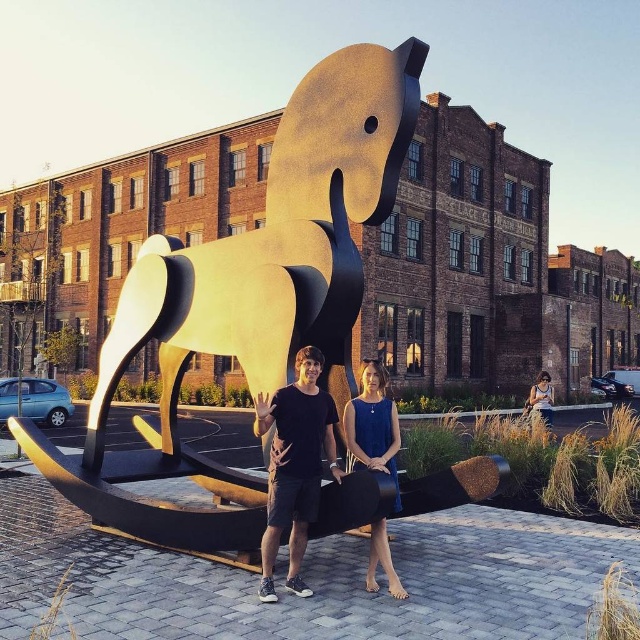
You are a photographer trying to capture a photo of the black matte shirt at center and the denim dress at lower right. Based on their positions, which one should you focus on first to ensure both are in the frame?

The black matte shirt at center is above the denim dress at lower right, so you should focus on the denim dress at lower right first to ensure both are in the frame.